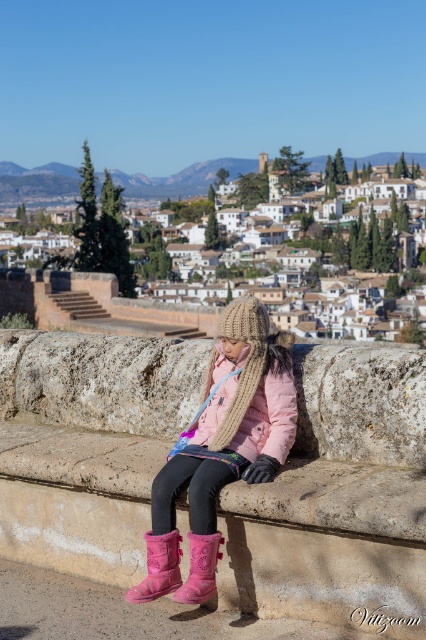
Question: Is pink suede boot at lower left above pink suede boot at lower center?

Choices:
 (A) yes
 (B) no

Answer: (A)

Question: Which point is closer to the camera?

Choices:
 (A) (187, 172)
 (B) (215, 552)
 (C) (146, 573)
 (D) (60, 520)

Answer: (B)

Question: Which point is farther to the camera?

Choices:
 (A) pink suede boots at center
 (B) stone ledge at center
 (C) pink suede boot at lower center

Answer: (A)

Question: Can you confirm if pink suede boots at center is thinner than pink suede boot at lower center?

Choices:
 (A) yes
 (B) no

Answer: (B)

Question: Can you confirm if pink suede boots at center is bigger than pink suede boot at lower center?

Choices:
 (A) yes
 (B) no

Answer: (A)

Question: Which of the following is the farthest from the observer?

Choices:
 (A) (331, 419)
 (B) (169, 547)

Answer: (A)